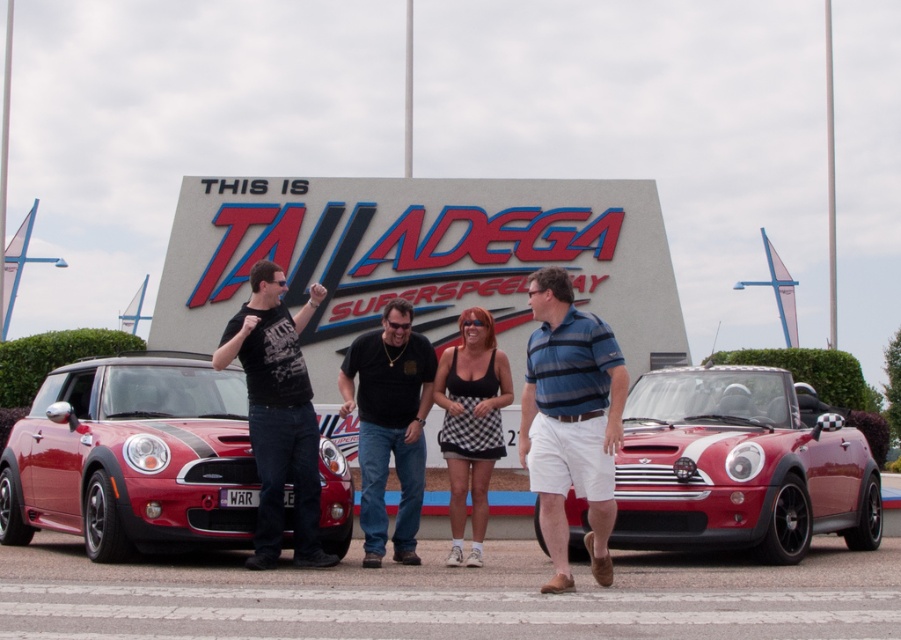
You are standing in front of the two red Mini Cooper cars at Talladega Superspeedway. There are two points marked on the cars. Which point is closer to you, the point at coordinate (121,372) or the point at (558,451)?

The point at coordinate (121,372) is closer to you because it is further to the viewer than the point at (558,451).

You are standing at the point marked by coordinates (739, 467) in the image. What type of vehicle do you see directly in front of you?

The shiny red convertible at center is located at point (739, 467), so you would see the shiny red convertible at center directly in front of you.